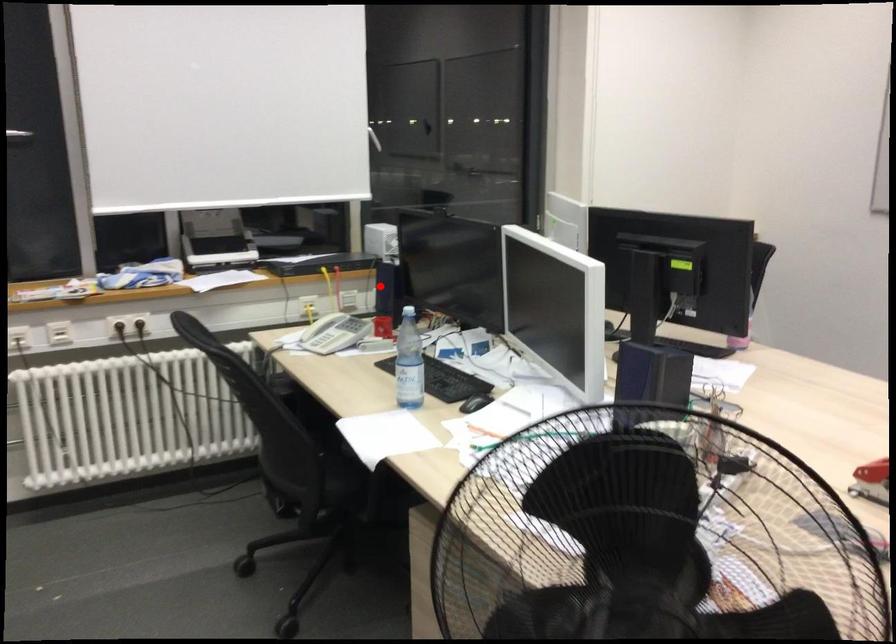
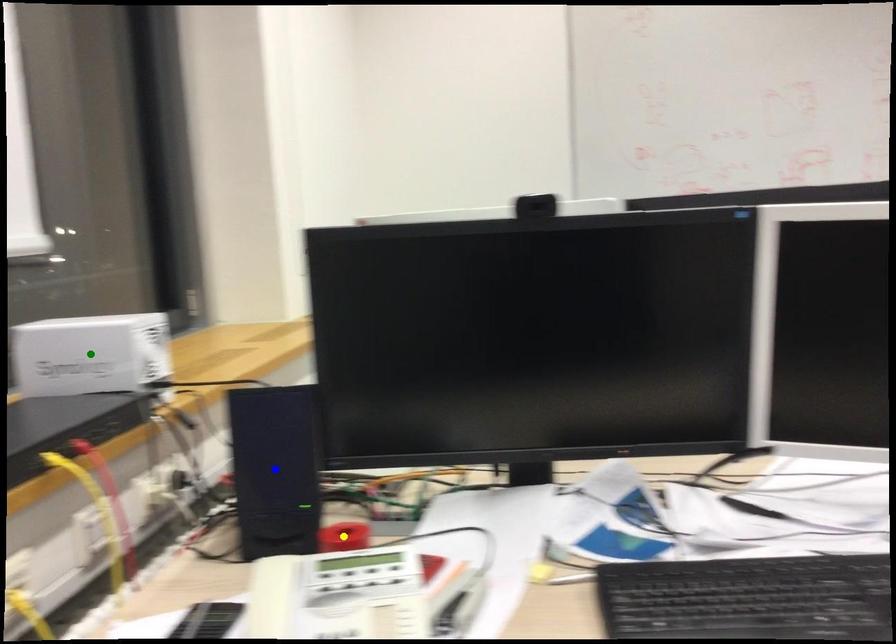
Question: I am providing you with two images of the same scene from different viewpoints. A red point is marked on the first image. You are given multiple points on the second image. Which mark in image 2 goes with the point in image 1?

Choices:
 (A) yellow point
 (B) green point
 (C) blue point

Answer: (C)